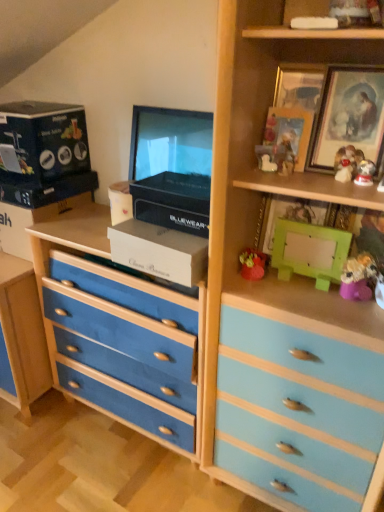
Question: In terms of height, does matte red figurine at upper right, which is the third toy from bottom to top, look taller or shorter compared to blue fabric chest of drawers at center?

Choices:
 (A) tall
 (B) short

Answer: (B)

Question: Looking at their shapes, would you say matte red figurine at upper right, the 2th toy in the top-to-bottom sequence, is wider or thinner than blue fabric chest of drawers at center?

Choices:
 (A) wide
 (B) thin

Answer: (B)

Question: Which object is positioned farthest from the white glossy figurine at upper right, the 2th toy from the left?

Choices:
 (A) matte black box at upper left, the fourth box when ordered from right to left
 (B) fuzzy yellow toy at right, positioned as the first toy in right-to-left order
 (C) matte cardboard box at upper left, which is the fifth box in right-to-left order
 (D) wooden framed picture at upper right, the first picture frame positioned from the right
 (E) wooden picture frame at upper right, which appears as the 1th picture frame when viewed from the left

Answer: (C)

Question: Which object is the closest to the green matte box at upper right, which is counted as the first box, starting from the right?

Choices:
 (A) fuzzy yellow toy at right, placed as the fourth toy when sorted from top to bottom
 (B) wooden picture frame at upper right, which appears as the 1th picture frame when viewed from the left
 (C) white cardboard box at center, the 3th box viewed from the left
 (D) matte red figurine at upper right, the 2th toy in the top-to-bottom sequence
 (E) blue fabric chest of drawers at center

Answer: (A)